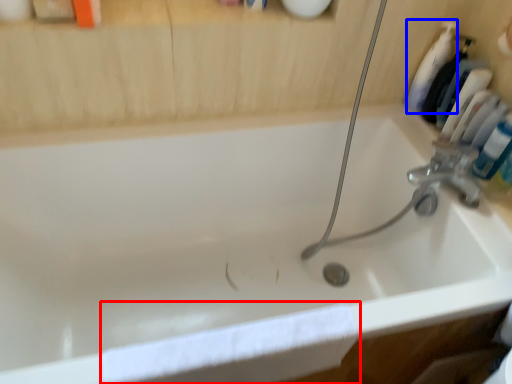
Question: Which point is further to the camera, bath towel (highlighted by a red box) or cleaning product (highlighted by a blue box)?

Choices:
 (A) bath towel
 (B) cleaning product

Answer: (B)